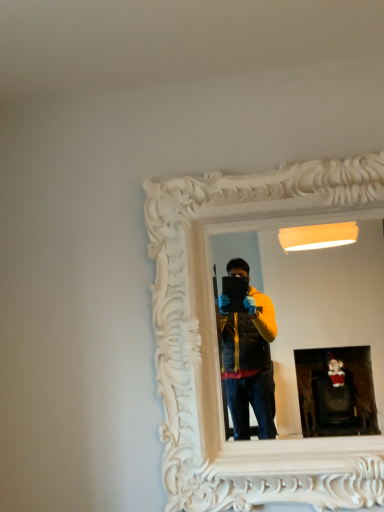
Where is `white carved mirror at upper center`? The height and width of the screenshot is (512, 384). white carved mirror at upper center is located at coordinates (216, 338).

In order to face white carved mirror at upper center, should I rotate leftwards or rightwards?

It's best to rotate right around 11.074 degrees.

This screenshot has width=384, height=512. What do you see at coordinates (216, 338) in the screenshot? I see `white carved mirror at upper center` at bounding box center [216, 338].

At what (x,y) coordinates should I click in order to perform the action: click on white carved mirror at upper center. Please return your answer as a coordinate pair (x, y). The height and width of the screenshot is (512, 384). Looking at the image, I should click on (216, 338).